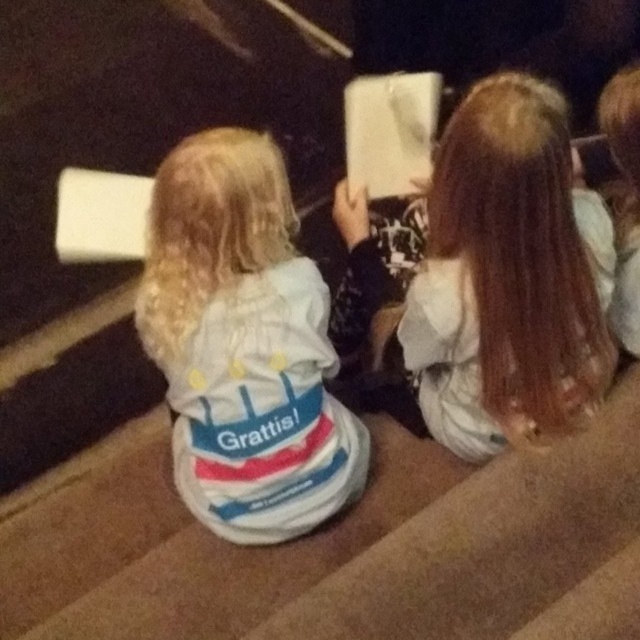
Does point (172, 202) come closer to viewer compared to point (609, 282)?

Yes, point (172, 202) is closer to viewer.

Is white soft hoodie at center taller than smooth brown hair at center?

Yes, white soft hoodie at center is taller than smooth brown hair at center.

Does point (205, 221) come closer to viewer compared to point (541, 208)?

No.

What are the coordinates of `white soft hoodie at center` in the screenshot? It's located at (243, 344).